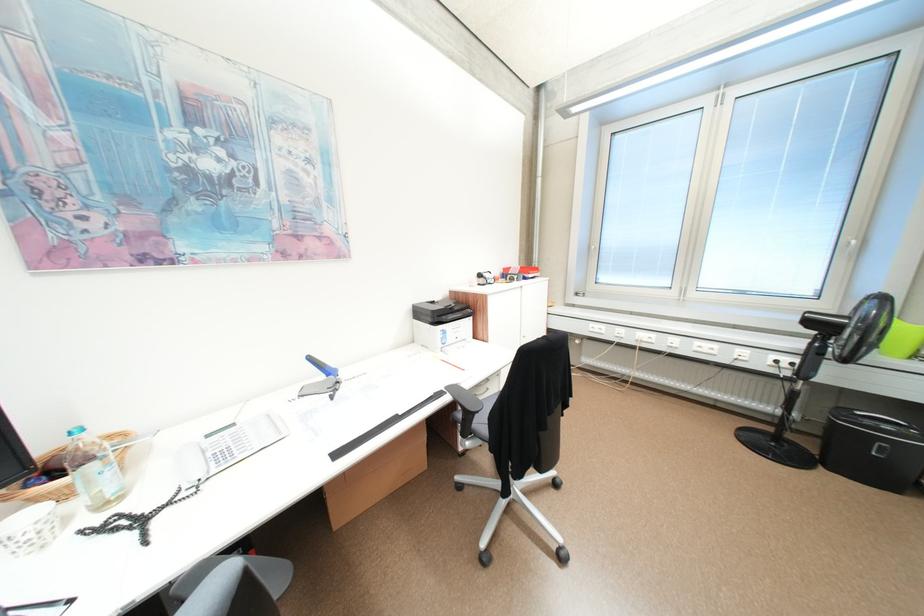
The location [448,363] corresponds to which object?

It refers to a red pencil.